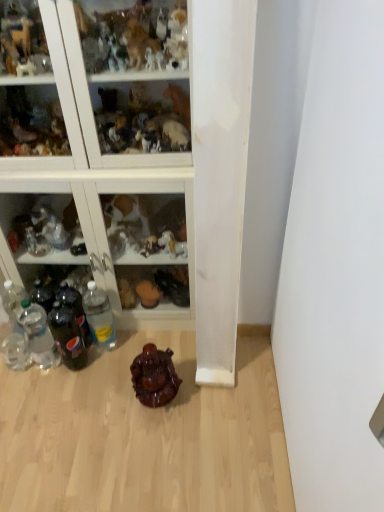
Where is `free space that is in between dark glass bottle at lower left, which is the 4th bottle in left-to-right order, and shiny brown statue at center`? free space that is in between dark glass bottle at lower left, which is the 4th bottle in left-to-right order, and shiny brown statue at center is located at coordinates (114, 380).